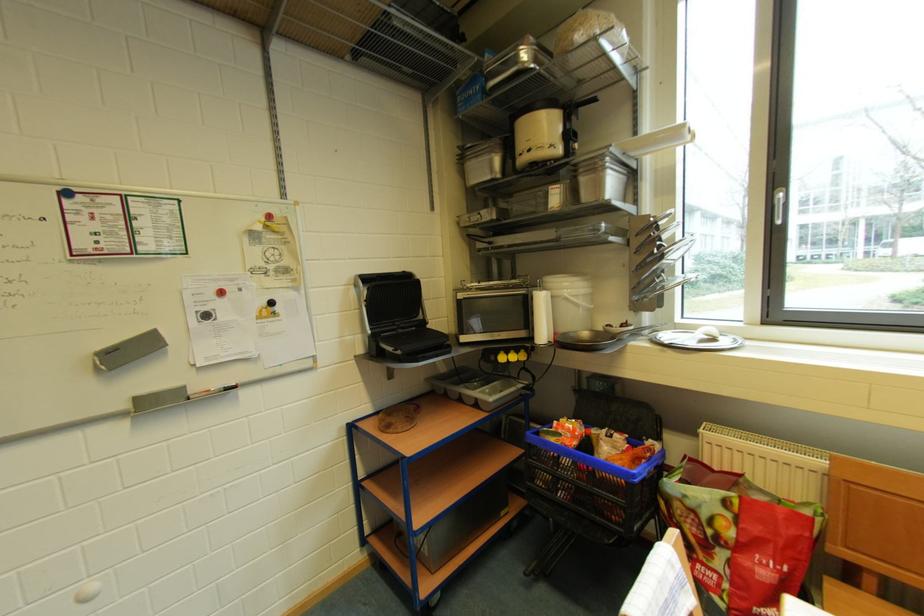
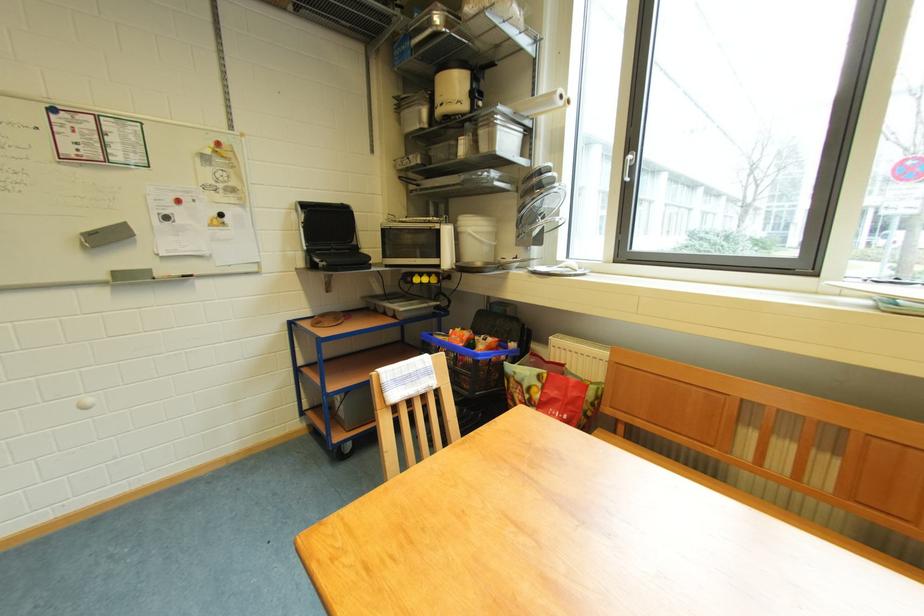
Find the pixel in the second image that matches (x=500, y=361) in the first image.

(417, 282)